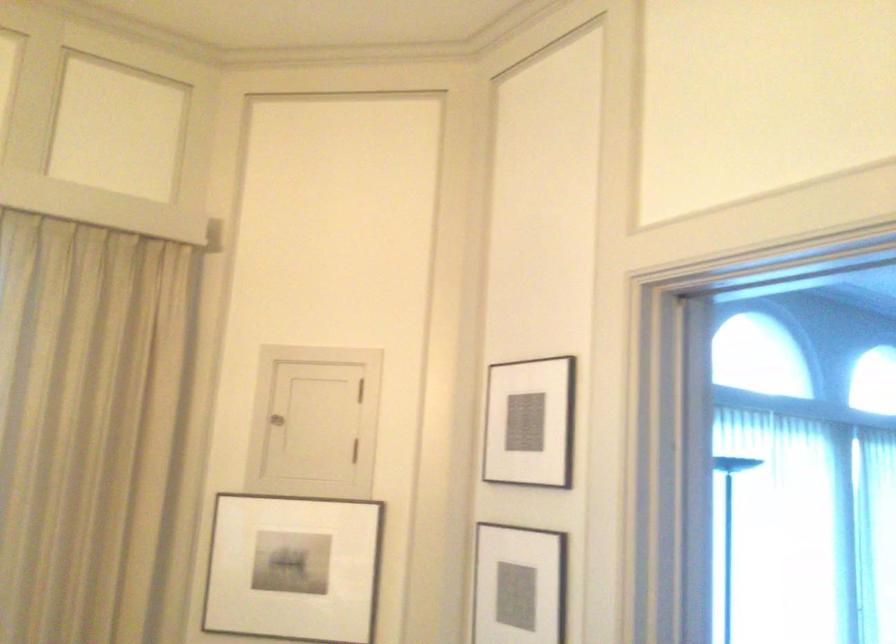
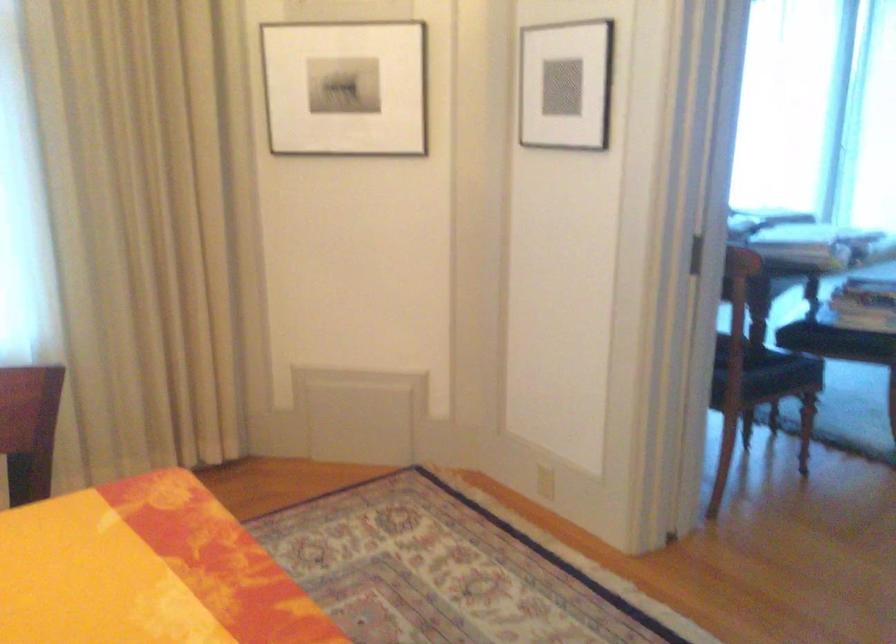
Which direction would the cameraman need to move to produce the second image?

The cameraman walked toward left, backward.